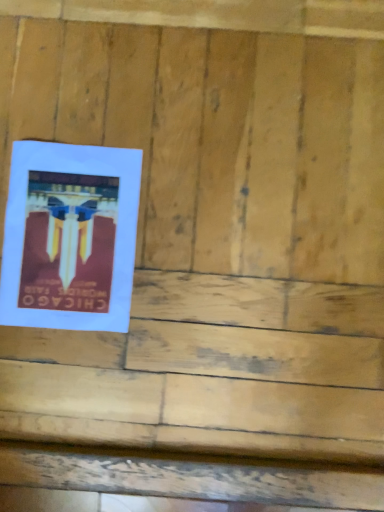
Locate an element on the screen. Image resolution: width=384 pixels, height=512 pixels. blank space above matte paper picture frame at upper left (from a real-world perspective) is located at coordinates pyautogui.click(x=63, y=238).